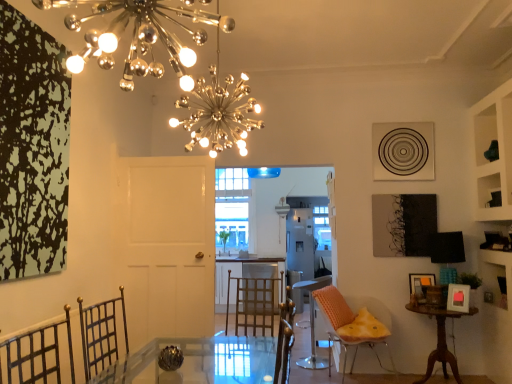
Question: Are clear glass window at center and white matte door at center located far from each other?

Choices:
 (A) yes
 (B) no

Answer: (A)

Question: Is clear glass window at center facing away from white matte door at center?

Choices:
 (A) yes
 (B) no

Answer: (B)

Question: Is clear glass window at center behind white matte door at center?

Choices:
 (A) yes
 (B) no

Answer: (A)

Question: Considering the relative sizes of clear glass window at center and white matte door at center in the image provided, is clear glass window at center wider than white matte door at center?

Choices:
 (A) yes
 (B) no

Answer: (A)

Question: Considering the relative sizes of clear glass window at center and white matte door at center in the image provided, is clear glass window at center shorter than white matte door at center?

Choices:
 (A) yes
 (B) no

Answer: (A)

Question: Does point (419, 296) appear closer or farther from the camera than point (461, 284)?

Choices:
 (A) closer
 (B) farther

Answer: (B)

Question: Is wooden picture frame at lower right, positioned as the 2th picture frame in front-to-back order, situated inside pink paper picture frame at lower right, which is the 1th picture frame in front-to-back order, or outside?

Choices:
 (A) outside
 (B) inside

Answer: (A)

Question: Based on their positions, is wooden picture frame at lower right, positioned as the 2th picture frame in front-to-back order, located to the left or right of pink paper picture frame at lower right, arranged as the second picture frame when viewed from the back?

Choices:
 (A) right
 (B) left

Answer: (B)

Question: Considering their positions, is wooden picture frame at lower right, the first picture frame when ordered from back to front, located in front of or behind pink paper picture frame at lower right, arranged as the second picture frame when viewed from the back?

Choices:
 (A) behind
 (B) front

Answer: (A)

Question: From the image's perspective, is white matte door at center positioned above or below orange textured chair at right, arranged as the first chair when viewed from the front?

Choices:
 (A) above
 (B) below

Answer: (A)

Question: From a real-world perspective, is white matte door at center positioned above or below orange textured chair at right, the second chair viewed from the back?

Choices:
 (A) below
 (B) above

Answer: (B)

Question: Considering the positions of point (190, 195) and point (325, 291), is point (190, 195) closer or farther from the camera than point (325, 291)?

Choices:
 (A) farther
 (B) closer

Answer: (B)

Question: Is white matte door at center in front of or behind orange textured chair at right, the second chair viewed from the back, in the image?

Choices:
 (A) behind
 (B) front

Answer: (B)

Question: Considering their positions, is orange textured chair at right, arranged as the first chair when viewed from the front, located in front of or behind wooden round table at lower right?

Choices:
 (A) behind
 (B) front

Answer: (B)

Question: Is point click(343, 337) positioned closer to the camera than point click(456, 372)?

Choices:
 (A) closer
 (B) farther

Answer: (B)